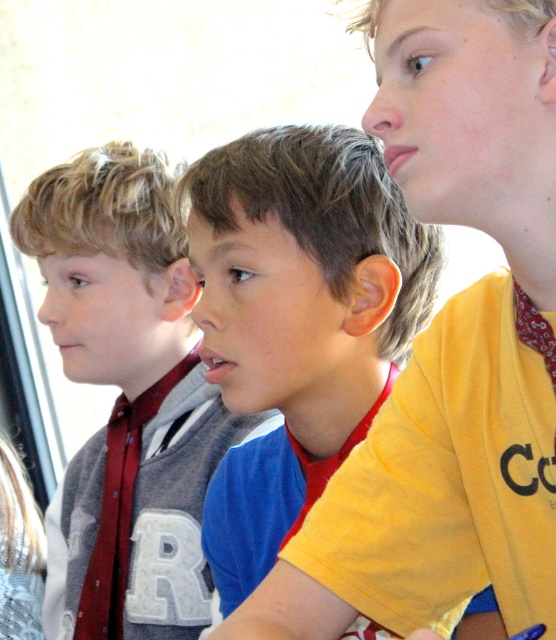
Does yellow matte shirt at center have a lesser height compared to matte red tie at left?

Incorrect, yellow matte shirt at center's height does not fall short of matte red tie at left's.

Between yellow matte shirt at center and matte red tie at left, which one appears on the left side from the viewer's perspective?

From the viewer's perspective, matte red tie at left appears more on the left side.

Is point (247, 371) farther from camera compared to point (115, 476)?

No, it is in front of (115, 476).

The width and height of the screenshot is (556, 640). Find the location of `yellow matte shirt at center`. yellow matte shirt at center is located at coordinates (297, 321).

Does point (374, 372) come closer to viewer compared to point (33, 230)?

Yes, point (374, 372) is in front of point (33, 230).

Is yellow matte shirt at center positioned in front of gray fleece sweater at left?

Yes, yellow matte shirt at center is closer to the viewer.

Describe the element at coordinates (297, 321) in the screenshot. The image size is (556, 640). I see `yellow matte shirt at center` at that location.

This screenshot has height=640, width=556. Find the location of `yellow matte shirt at center`. yellow matte shirt at center is located at coordinates (297, 321).

Can you confirm if gray fleece sweater at left is positioned to the right of matte red tie at left?

Indeed, gray fleece sweater at left is positioned on the right side of matte red tie at left.

Does gray fleece sweater at left have a greater height compared to matte red tie at left?

Correct, gray fleece sweater at left is much taller as matte red tie at left.

Which is in front, point (132, 200) or point (140, 428)?

Positioned in front is point (132, 200).

At what (x,y) coordinates should I click in order to perform the action: click on gray fleece sweater at left. Please return your answer as a coordinate pair (x, y). Looking at the image, I should click on (128, 392).